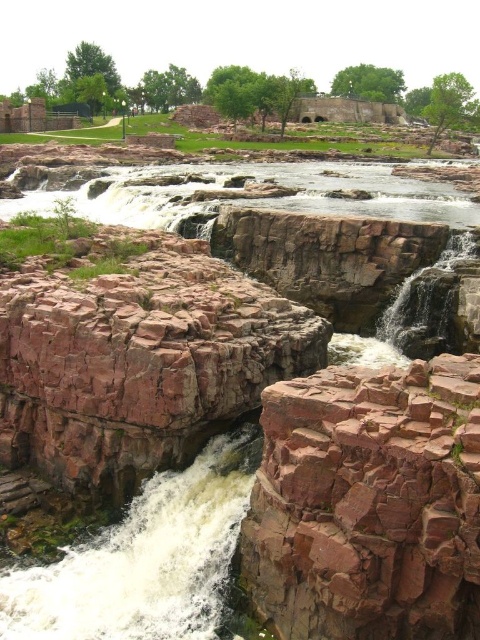
Question: Does brown rock waterfall at lower left have a greater width compared to white frothy water at center?

Choices:
 (A) yes
 (B) no

Answer: (B)

Question: Does brown rock waterfall at lower left have a smaller size compared to white frothy water at center?

Choices:
 (A) no
 (B) yes

Answer: (B)

Question: Which object is the farthest from the white frothy water at center?

Choices:
 (A) brown rock waterfall at lower left
 (B) rusty stone bridge at center

Answer: (A)

Question: Which object is positioned farthest from the white frothy water at center?

Choices:
 (A) brown rock waterfall at lower left
 (B) rusty stone bridge at center

Answer: (A)

Question: Is brown rock waterfall at lower left wider than white frothy water at center?

Choices:
 (A) yes
 (B) no

Answer: (B)

Question: Which object is farther from the camera taking this photo?

Choices:
 (A) white frothy water at center
 (B) brown rock waterfall at lower left

Answer: (A)